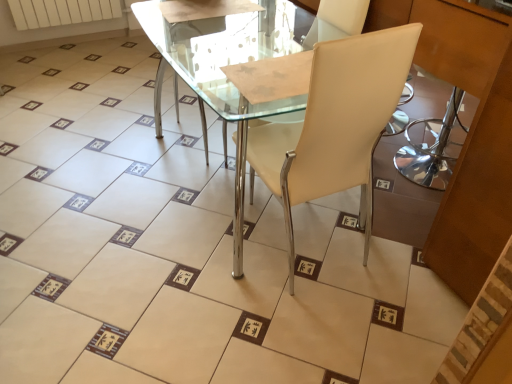
Question: Is beige leather chair at center bigger than white matte radiator at upper left?

Choices:
 (A) yes
 (B) no

Answer: (A)

Question: From a real-world perspective, is beige leather chair at center under white matte radiator at upper left?

Choices:
 (A) no
 (B) yes

Answer: (A)

Question: From the image's perspective, would you say beige leather chair at center is shown under white matte radiator at upper left?

Choices:
 (A) no
 (B) yes

Answer: (B)

Question: Considering the relative sizes of beige leather chair at center and white matte radiator at upper left in the image provided, is beige leather chair at center thinner than white matte radiator at upper left?

Choices:
 (A) no
 (B) yes

Answer: (A)

Question: Is beige leather chair at center facing towards white matte radiator at upper left?

Choices:
 (A) yes
 (B) no

Answer: (B)

Question: In terms of height, does beige leather chair at center look taller or shorter compared to transparent glass table at center?

Choices:
 (A) short
 (B) tall

Answer: (B)

Question: From the image's perspective, is beige leather chair at center located above or below transparent glass table at center?

Choices:
 (A) above
 (B) below

Answer: (B)

Question: Considering their positions, is beige leather chair at center located in front of or behind transparent glass table at center?

Choices:
 (A) behind
 (B) front

Answer: (B)

Question: Choose the correct answer: Is beige leather chair at center inside transparent glass table at center or outside it?

Choices:
 (A) inside
 (B) outside

Answer: (B)

Question: Looking at the image, does transparent glass table at center seem bigger or smaller compared to beige leather chair at center?

Choices:
 (A) small
 (B) big

Answer: (A)

Question: Is transparent glass table at center taller or shorter than beige leather chair at center?

Choices:
 (A) tall
 (B) short

Answer: (B)

Question: Looking at their shapes, would you say transparent glass table at center is wider or thinner than beige leather chair at center?

Choices:
 (A) thin
 (B) wide

Answer: (A)

Question: Relative to beige leather chair at center, is transparent glass table at center in front or behind?

Choices:
 (A) behind
 (B) front

Answer: (A)

Question: Looking at the image, does white matte radiator at upper left seem bigger or smaller compared to beige leather chair at center?

Choices:
 (A) big
 (B) small

Answer: (B)

Question: Considering the positions of white matte radiator at upper left and beige leather chair at center in the image, is white matte radiator at upper left wider or thinner than beige leather chair at center?

Choices:
 (A) wide
 (B) thin

Answer: (B)